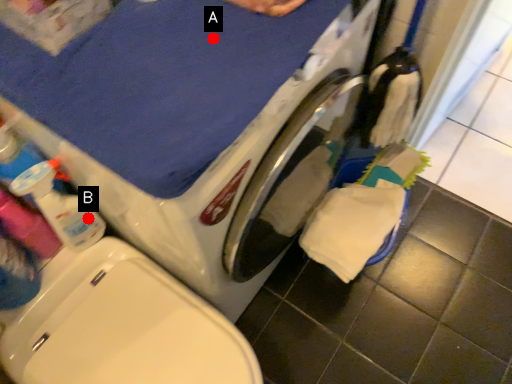
Question: Two points are circled on the image, labeled by A and B beside each circle. Among these points, which one is nearest to the camera?

Choices:
 (A) A is closer
 (B) B is closer

Answer: (A)